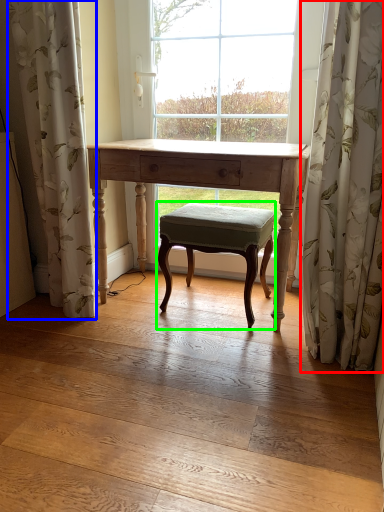
Question: Considering the real-world distances, which object is closest to curtain (highlighted by a red box)? curtain (highlighted by a blue box) or stool (highlighted by a green box).

Choices:
 (A) curtain
 (B) stool

Answer: (B)